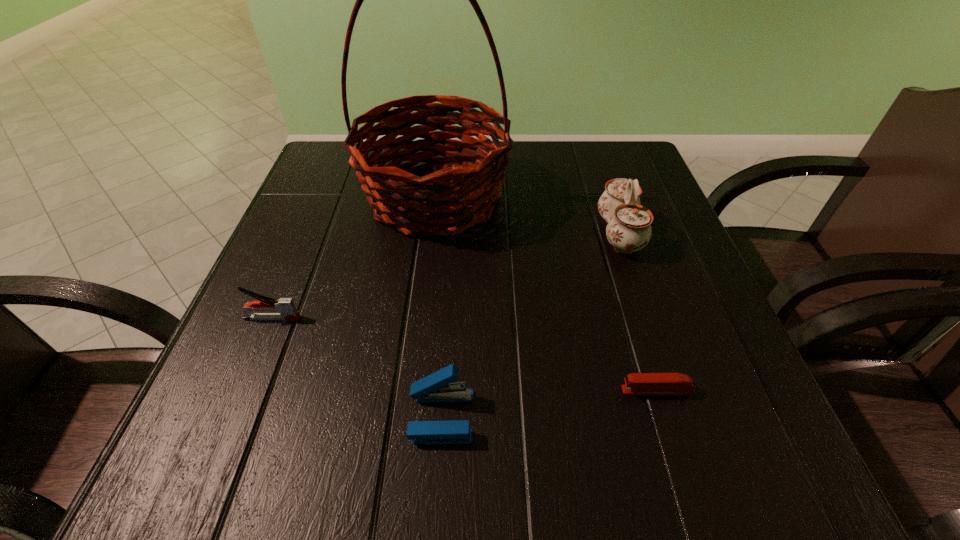
Locate an element on the screen. the tallest object is located at coordinates (448, 199).

The height and width of the screenshot is (540, 960). Find the location of `the second tallest object`. the second tallest object is located at coordinates click(628, 230).

Where is `the leftmost stapler`? Image resolution: width=960 pixels, height=540 pixels. the leftmost stapler is located at coordinates (287, 311).

The width and height of the screenshot is (960, 540). Find the location of `the farthest stapler`. the farthest stapler is located at coordinates (287, 311).

Locate an element on the screen. the second stapler from right to left is located at coordinates (437, 387).

Find the location of a particular element. the shortest object is located at coordinates (635, 383).

The width and height of the screenshot is (960, 540). Identify the location of the rightmost stapler. (x=635, y=383).

The image size is (960, 540). What are the coordinates of `vacant space located 0.100m on the front of the tallest object` in the screenshot? It's located at (424, 287).

At what (x,y) coordinates should I click in order to perform the action: click on vacant position located 0.380m by the handle of the chinaware. Please return your answer as a coordinate pair (x, y). Looking at the image, I should click on (410, 234).

Where is `blank space located by the handle of the chinaware`? Image resolution: width=960 pixels, height=540 pixels. blank space located by the handle of the chinaware is located at coordinates (499, 234).